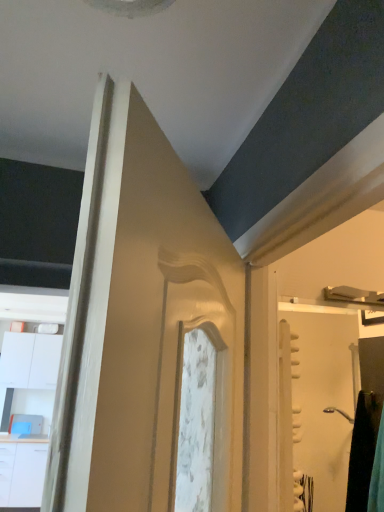
Question: Do you think white glossy drawer at lower left is within white glossy screen door at right, or outside of it?

Choices:
 (A) inside
 (B) outside

Answer: (B)

Question: Is white glossy drawer at lower left to the left or to the right of white glossy screen door at right in the image?

Choices:
 (A) left
 (B) right

Answer: (A)

Question: Which object is the closest to the white glossy cabinet at left?

Choices:
 (A) white glossy drawer at lower left
 (B) white glossy screen door at right

Answer: (A)

Question: Which is nearer to the white glossy cabinet at left?

Choices:
 (A) white glossy drawer at lower left
 (B) white glossy screen door at right

Answer: (A)